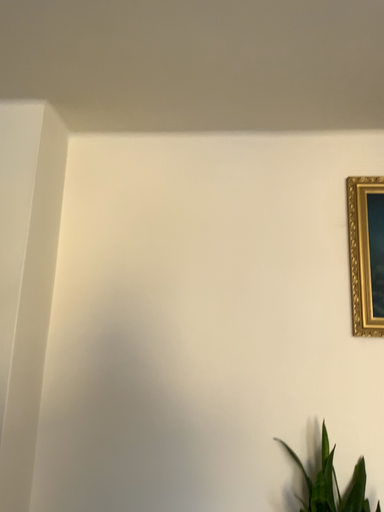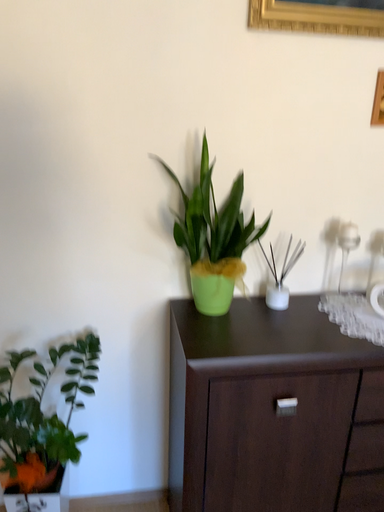
Question: How did the camera likely rotate when shooting the video?

Choices:
 (A) rotated upward
 (B) rotated downward

Answer: (B)